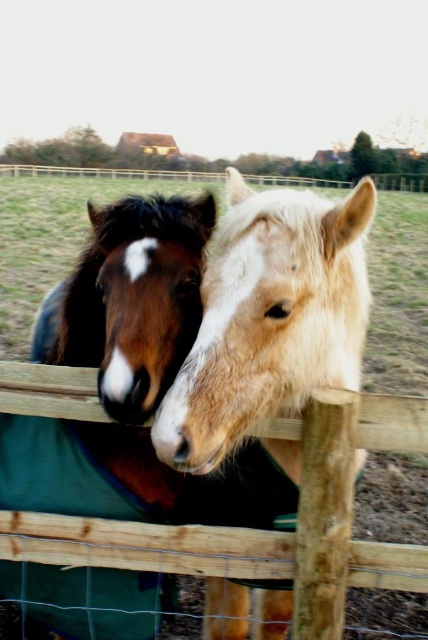
Question: Is light brown fur at center thinner than wooden fence at center?

Choices:
 (A) yes
 (B) no

Answer: (A)

Question: Which of the following is the closest to the observer?

Choices:
 (A) (276, 451)
 (B) (332, 397)

Answer: (B)

Question: Does light brown fur at center have a larger size compared to wooden fence at center?

Choices:
 (A) no
 (B) yes

Answer: (A)

Question: Where is light brown fur at center located in relation to wooden fence at center in the image?

Choices:
 (A) below
 (B) above

Answer: (B)